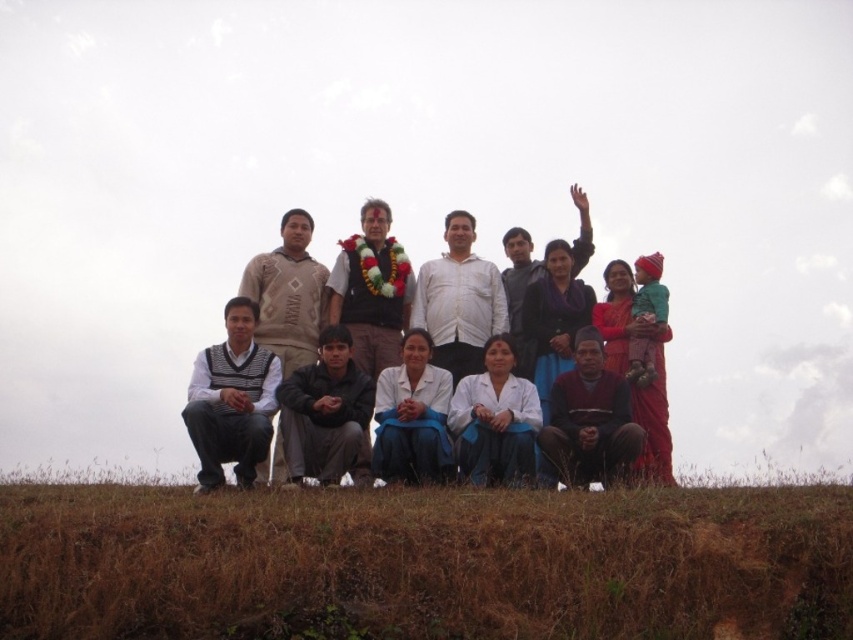
How distant is white cotton shirt at center from brown cotton sweater at lower center?

The distance of white cotton shirt at center from brown cotton sweater at lower center is 36.66 feet.

Which of these two, white cotton shirt at center or brown cotton sweater at lower center, stands shorter?

brown cotton sweater at lower center

Measure the distance between white cotton shirt at center and camera.

white cotton shirt at center is 80.62 meters from camera.

Locate an element on the screen. This screenshot has width=853, height=640. white cotton shirt at center is located at coordinates (654, 406).

Between striped sweater at lower left and knitted beige sweater at center, which one appears on the left side from the viewer's perspective?

Positioned to the left is striped sweater at lower left.

Is striped sweater at lower left above knitted beige sweater at center?

Incorrect, striped sweater at lower left is not positioned above knitted beige sweater at center.

Which is behind, point (262, 376) or point (299, 248)?

The point (299, 248) is more distant.

At what (x,y) coordinates should I click in order to perform the action: click on striped sweater at lower left. Please return your answer as a coordinate pair (x, y). Looking at the image, I should click on (231, 401).

Can you confirm if brown grass at lower center is positioned below white cotton shirt at center?

Correct, brown grass at lower center is located below white cotton shirt at center.

Can you confirm if brown grass at lower center is wider than white cotton shirt at center?

Yes, brown grass at lower center is wider than white cotton shirt at center.

Find the location of a particular element. This screenshot has height=640, width=853. brown grass at lower center is located at coordinates (425, 563).

Find the location of `brown grass at lower center`. brown grass at lower center is located at coordinates (425, 563).